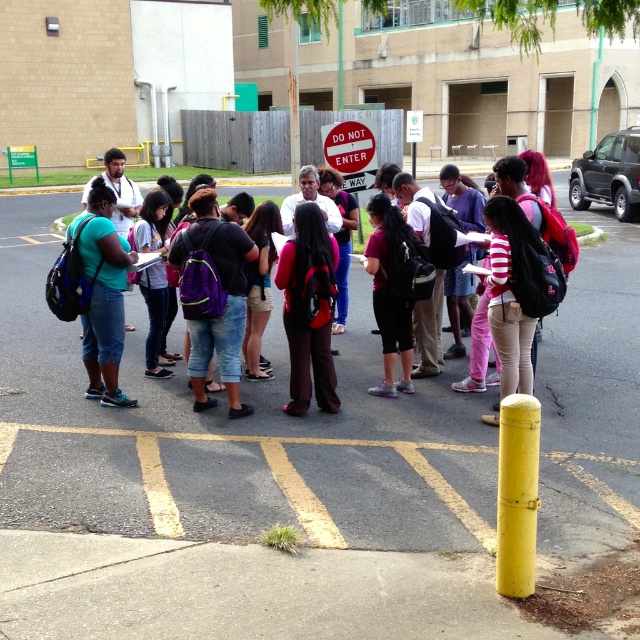
Where is the yellow asphalt parking line at lower center located in the image?

The yellow asphalt parking line at lower center is located at point [273,476] in the image.

You are a delivery person who needs to place a package on the ground. You see the yellow asphalt parking line at lower center and the matte black backpack at center. Which object is closer to the ground?

The yellow asphalt parking line at lower center is positioned under the matte black backpack at center, so the yellow asphalt parking line at lower center is closer to the ground.

You are standing at the yellow bollard on the right side of the parking lot. You need to walk to the point marked at coordinates (273, 476). Which direction should you walk relative to the yellow bollard on the right side?

The point marked at coordinates (273, 476) is located on the yellow asphalt parking line at lower center. Since you are at the yellow bollard on the right side, you should walk towards the lower center direction to reach the point.